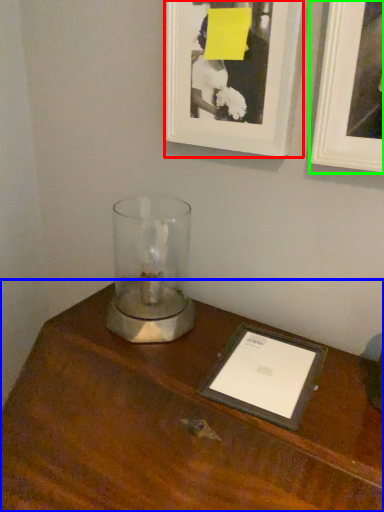
Question: Based on their relative distances, which object is nearer to picture frame (highlighted by a red box)? Choose from table (highlighted by a blue box) and picture frame (highlighted by a green box).

Choices:
 (A) table
 (B) picture frame

Answer: (B)